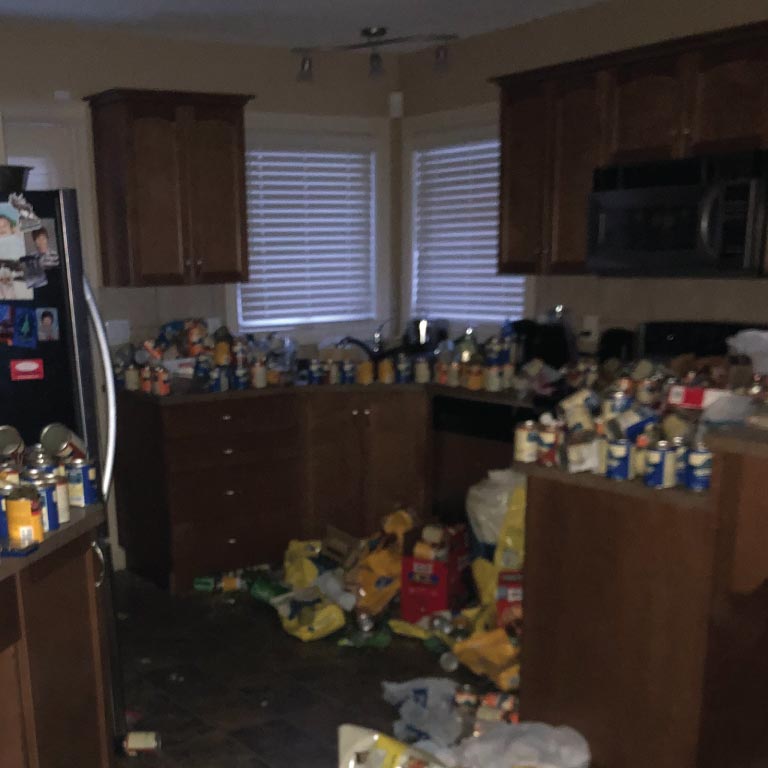
Where is `microwave handle`? The width and height of the screenshot is (768, 768). microwave handle is located at coordinates point(703,230).